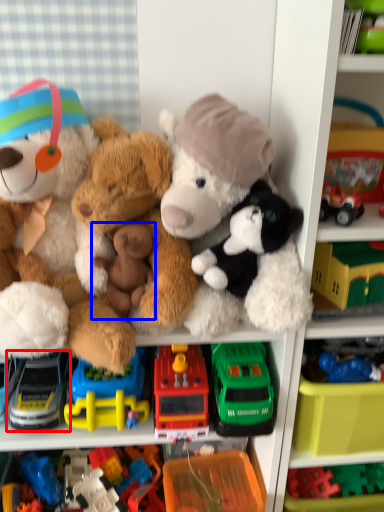
Question: Which object appears closest to the camera in this image, toy (highlighted by a red box) or toy (highlighted by a blue box)?

Choices:
 (A) toy
 (B) toy

Answer: (B)